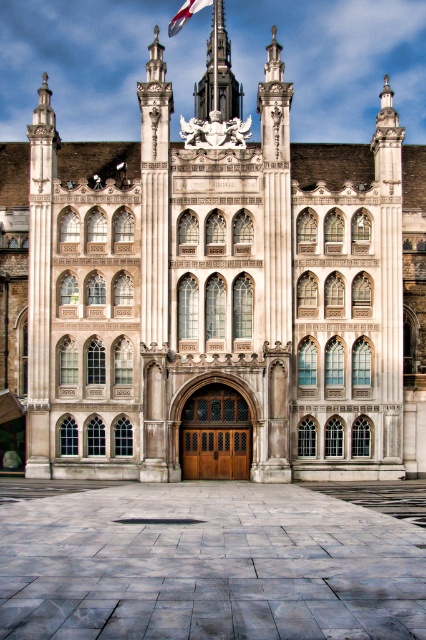
Question: Which of the following is the farthest from the observer?

Choices:
 (A) white fabric flag at upper center
 (B) polished stone pillar at upper left

Answer: (A)

Question: In this image, where is polished stone pillar at upper left located relative to white fabric flag at upper center?

Choices:
 (A) below
 (B) above

Answer: (A)

Question: Where is polished stone pillar at upper left located in relation to white fabric flag at upper center in the image?

Choices:
 (A) left
 (B) right

Answer: (A)

Question: Which point appears closest to the camera in this image?

Choices:
 (A) (48, 448)
 (B) (189, 13)

Answer: (A)

Question: Does polished stone pillar at upper left have a lesser width compared to white fabric flag at upper center?

Choices:
 (A) no
 (B) yes

Answer: (A)